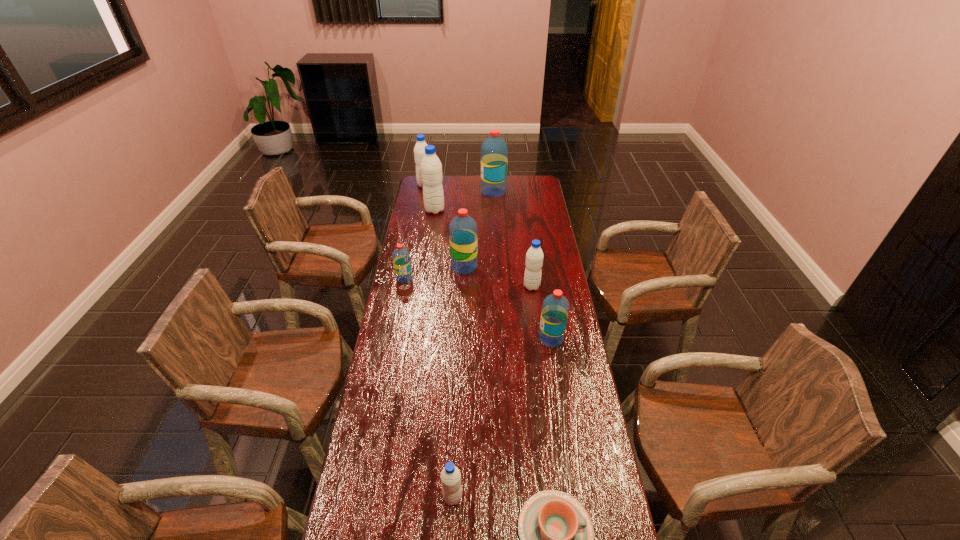
Identify which red water bottle is located as the second nearest to the leftmost red water bottle. Please provide its 2D coordinates. Your answer should be formatted as a tuple, i.e. [(x, y)], where the tuple contains the x and y coordinates of a point satisfying the conditions above.

[(555, 308)]

Locate which red water bottle ranks in proximity to the leftmost red water bottle. Please provide its 2D coordinates. Your answer should be formatted as a tuple, i.e. [(x, y)], where the tuple contains the x and y coordinates of a point satisfying the conditions above.

[(462, 229)]

This screenshot has width=960, height=540. Find the location of `gray water bottle that is the third closest to the nearest red water bottle`. gray water bottle that is the third closest to the nearest red water bottle is located at coordinates (431, 168).

Identify which gray water bottle is the fourth closest to the pink chinaware. Please provide its 2D coordinates. Your answer should be formatted as a tuple, i.e. [(x, y)], where the tuple contains the x and y coordinates of a point satisfying the conditions above.

[(419, 150)]

Locate an element on the screen. This screenshot has height=540, width=960. free space that satisfies the following two spatial constraints: 1. on the front label of the nearest red water bottle; 2. on the front side of the nearest water bottle is located at coordinates (576, 497).